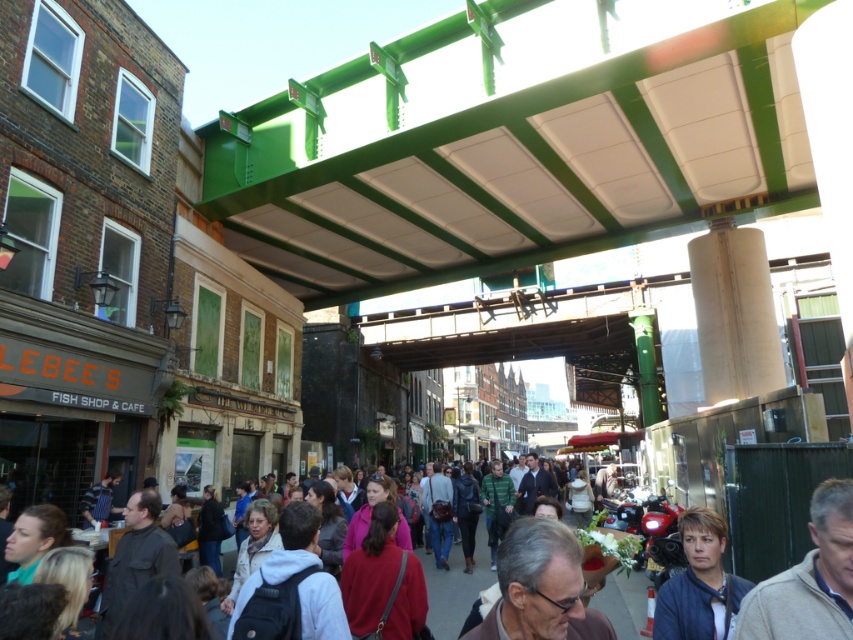
Question: Among these objects, which one is nearest to the camera?

Choices:
 (A) light brown leather jacket at lower right
 (B) dark blue jacket at lower right

Answer: (A)

Question: Is light brown leather jacket at lower right below dark blue jacket at lower right?

Choices:
 (A) yes
 (B) no

Answer: (B)

Question: Is light brown leather jacket at lower right positioned at the back of dark blue jacket at lower right?

Choices:
 (A) yes
 (B) no

Answer: (B)

Question: Is light brown leather jacket at lower right bigger than dark blue jacket at lower right?

Choices:
 (A) yes
 (B) no

Answer: (B)